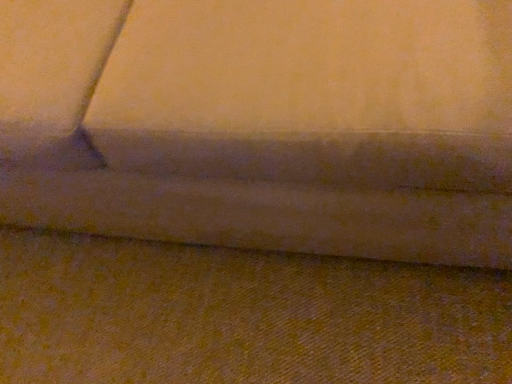
Question: Is velvet-like fabric couch at center shorter than yellow fabric at lower center?

Choices:
 (A) no
 (B) yes

Answer: (A)

Question: Can you confirm if velvet-like fabric couch at center is bigger than yellow fabric at lower center?

Choices:
 (A) no
 (B) yes

Answer: (B)

Question: From a real-world perspective, is velvet-like fabric couch at center beneath yellow fabric at lower center?

Choices:
 (A) no
 (B) yes

Answer: (A)

Question: Does velvet-like fabric couch at center have a greater height compared to yellow fabric at lower center?

Choices:
 (A) no
 (B) yes

Answer: (B)

Question: Is velvet-like fabric couch at center looking in the opposite direction of yellow fabric at lower center?

Choices:
 (A) yes
 (B) no

Answer: (B)

Question: Can you confirm if velvet-like fabric couch at center is smaller than yellow fabric at lower center?

Choices:
 (A) no
 (B) yes

Answer: (A)

Question: Could velvet-like fabric couch at center be considered to be inside yellow fabric at lower center?

Choices:
 (A) yes
 (B) no

Answer: (B)

Question: Is yellow fabric at lower center positioned beyond the bounds of velvet-like fabric couch at center?

Choices:
 (A) yes
 (B) no

Answer: (A)

Question: Is yellow fabric at lower center looking in the opposite direction of velvet-like fabric couch at center?

Choices:
 (A) yes
 (B) no

Answer: (B)

Question: Can you confirm if yellow fabric at lower center is bigger than velvet-like fabric couch at center?

Choices:
 (A) yes
 (B) no

Answer: (B)

Question: Can you confirm if yellow fabric at lower center is thinner than velvet-like fabric couch at center?

Choices:
 (A) no
 (B) yes

Answer: (B)

Question: Can you see yellow fabric at lower center touching velvet-like fabric couch at center?

Choices:
 (A) no
 (B) yes

Answer: (A)

Question: Does point (403, 54) appear closer or farther from the camera than point (333, 375)?

Choices:
 (A) closer
 (B) farther

Answer: (A)